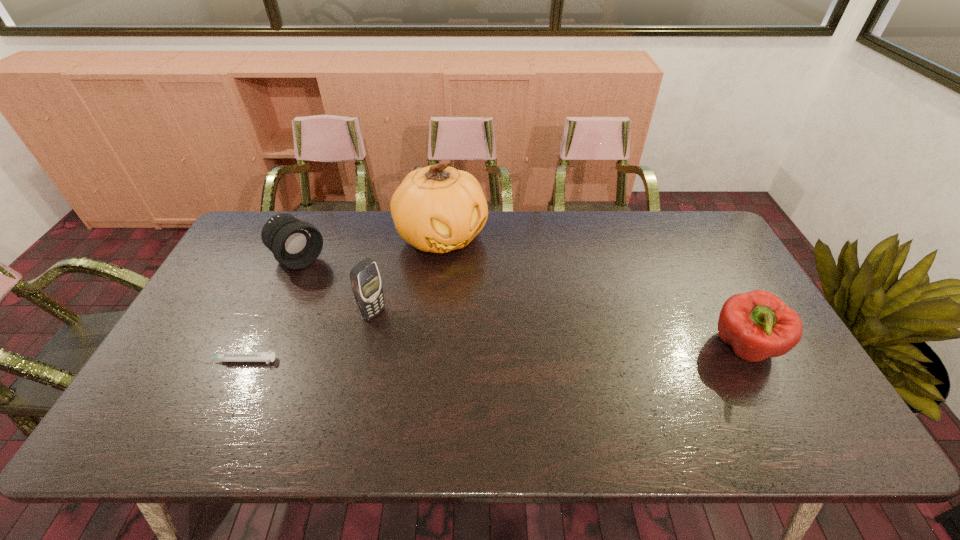
Locate an element on the screen. free space on the desktop that is between the shortest object and the rightmost object and is positioned at the front element of the telephoto lens is located at coordinates (420, 356).

At what (x,y) coordinates should I click in order to perform the action: click on vacant space on the desktop that is between the shortest object and the rightmost object and is positioned on the front face of the cellular telephone. Please return your answer as a coordinate pair (x, y). Looking at the image, I should click on (445, 355).

The height and width of the screenshot is (540, 960). Find the location of `vacant space on the desktop that is between the syringe and the bell pepper and is positioned on the front face of the tallest object`. vacant space on the desktop that is between the syringe and the bell pepper and is positioned on the front face of the tallest object is located at coordinates (536, 353).